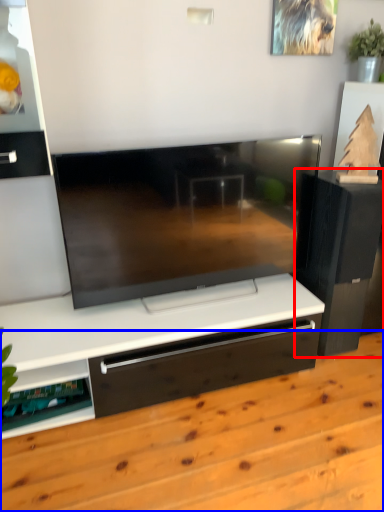
Question: Which object is further to the camera taking this photo, furniture (highlighted by a red box) or hardwood (highlighted by a blue box)?

Choices:
 (A) furniture
 (B) hardwood

Answer: (A)